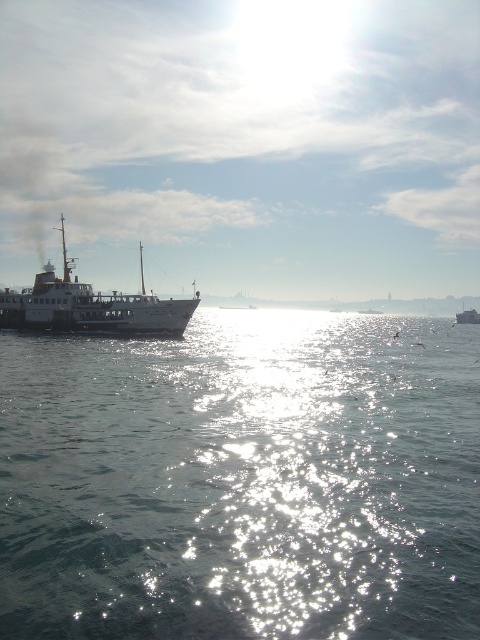
From the picture: How much distance is there between glistening water at center and metallic gray ferry at left?

glistening water at center and metallic gray ferry at left are 18.80 meters apart from each other.

You are a GUI agent. You are given a task and a screenshot of the screen. Output one action in this format:
    pyautogui.click(x=<x>, y=<y>)
    Task: Click on the glistening water at center
    Image resolution: width=480 pixels, height=640 pixels.
    Given the screenshot: What is the action you would take?
    pyautogui.click(x=242, y=480)

Identify the location of glistening water at center. Image resolution: width=480 pixels, height=640 pixels. 242,480.

Between glistening water at center and metallic gray ferry at right, which one is positioned higher?

Positioned higher is metallic gray ferry at right.

Can you confirm if glistening water at center is smaller than metallic gray ferry at right?

Yes, glistening water at center is smaller than metallic gray ferry at right.

Does point (94, 572) lie behind point (458, 316)?

No, (94, 572) is closer to viewer.

Where is `glistening water at center`? glistening water at center is located at coordinates (242, 480).

Does metallic gray ferry at left have a smaller size compared to metallic gray ferry at right?

Indeed, metallic gray ferry at left has a smaller size compared to metallic gray ferry at right.

Is metallic gray ferry at left positioned in front of metallic gray ferry at right?

Yes, metallic gray ferry at left is closer to the viewer.

Is point (120, 296) farther from viewer compared to point (467, 310)?

No, (120, 296) is in front of (467, 310).

The image size is (480, 640). In order to click on metallic gray ferry at left in this screenshot , I will do `click(91, 305)`.